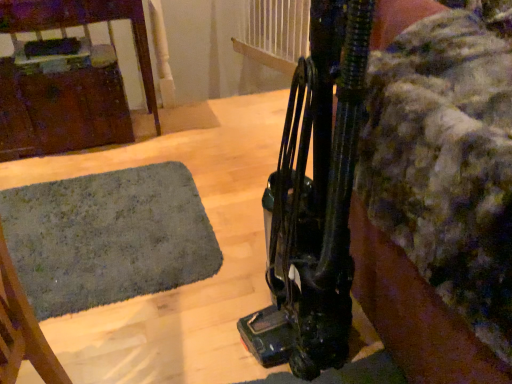
Question: From the image's perspective, is black rubber vacuum cleaner at right over dark green carpet at lower left?

Choices:
 (A) no
 (B) yes

Answer: (B)

Question: Can you confirm if black rubber vacuum cleaner at right is bigger than dark green carpet at lower left?

Choices:
 (A) yes
 (B) no

Answer: (A)

Question: Are black rubber vacuum cleaner at right and dark green carpet at lower left far apart?

Choices:
 (A) yes
 (B) no

Answer: (B)

Question: Considering the relative sizes of black rubber vacuum cleaner at right and dark green carpet at lower left in the image provided, is black rubber vacuum cleaner at right thinner than dark green carpet at lower left?

Choices:
 (A) yes
 (B) no

Answer: (A)

Question: Considering the relative sizes of black rubber vacuum cleaner at right and dark green carpet at lower left in the image provided, is black rubber vacuum cleaner at right smaller than dark green carpet at lower left?

Choices:
 (A) yes
 (B) no

Answer: (B)

Question: Is black rubber vacuum cleaner at right to the left of dark green carpet at lower left from the viewer's perspective?

Choices:
 (A) yes
 (B) no

Answer: (B)

Question: From a real-world perspective, is brushed metal cabinet at left physically above black rubber vacuum cleaner at right?

Choices:
 (A) no
 (B) yes

Answer: (A)

Question: From a real-world perspective, is brushed metal cabinet at left below black rubber vacuum cleaner at right?

Choices:
 (A) yes
 (B) no

Answer: (A)

Question: Is black rubber vacuum cleaner at right a part of brushed metal cabinet at left?

Choices:
 (A) no
 (B) yes

Answer: (A)

Question: From the image's perspective, would you say brushed metal cabinet at left is shown under black rubber vacuum cleaner at right?

Choices:
 (A) no
 (B) yes

Answer: (A)

Question: Is the depth of brushed metal cabinet at left less than that of black rubber vacuum cleaner at right?

Choices:
 (A) yes
 (B) no

Answer: (B)

Question: Does brushed metal cabinet at left lie behind black rubber vacuum cleaner at right?

Choices:
 (A) no
 (B) yes

Answer: (B)

Question: Is black rubber vacuum cleaner at right further to the viewer compared to brushed metal cabinet at left?

Choices:
 (A) yes
 (B) no

Answer: (B)